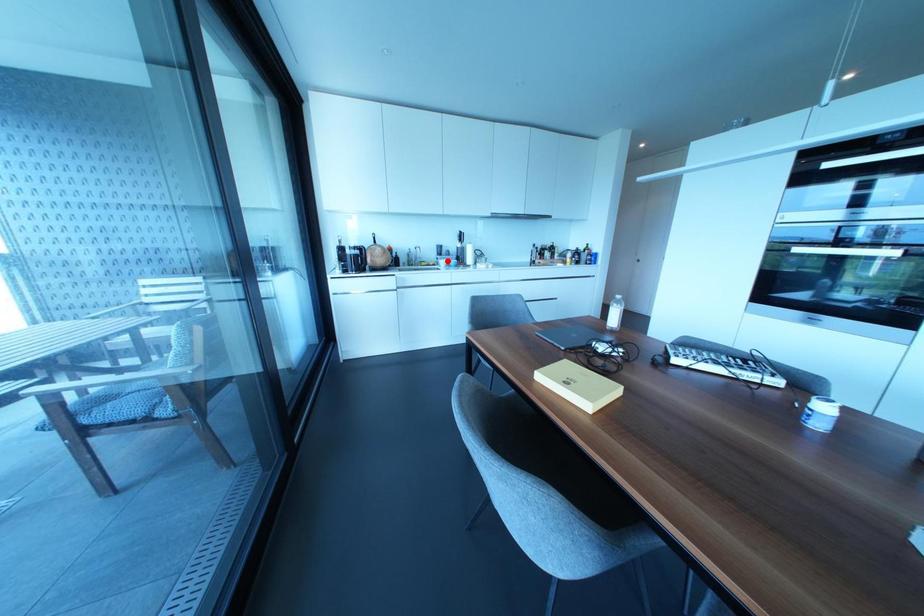
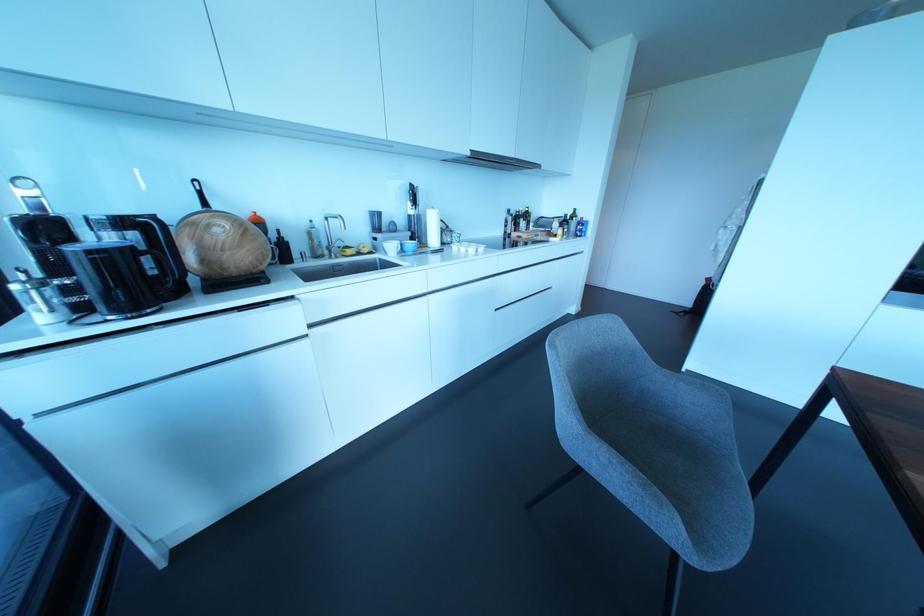
Find the pixel in the second image that matches the highlighted location in the first image.

(400, 244)